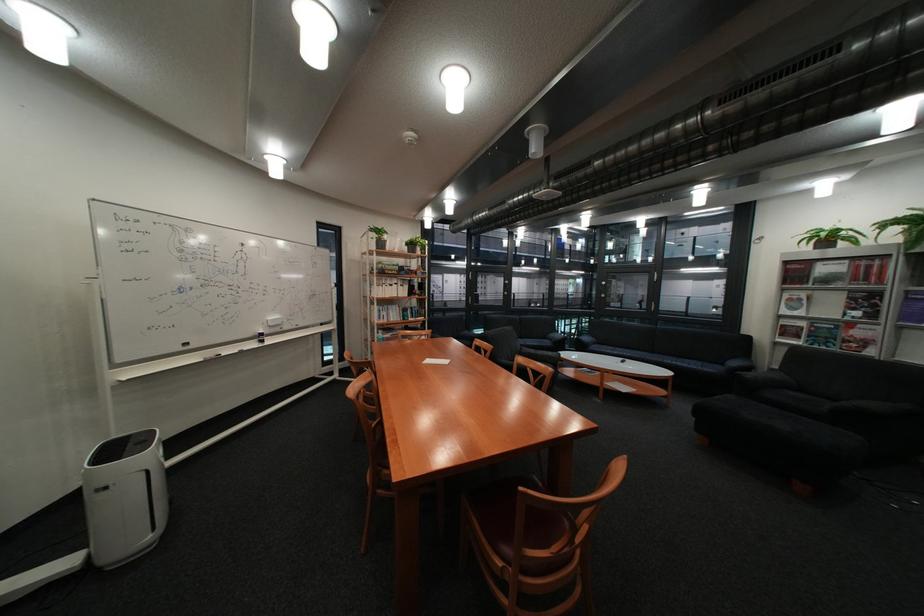
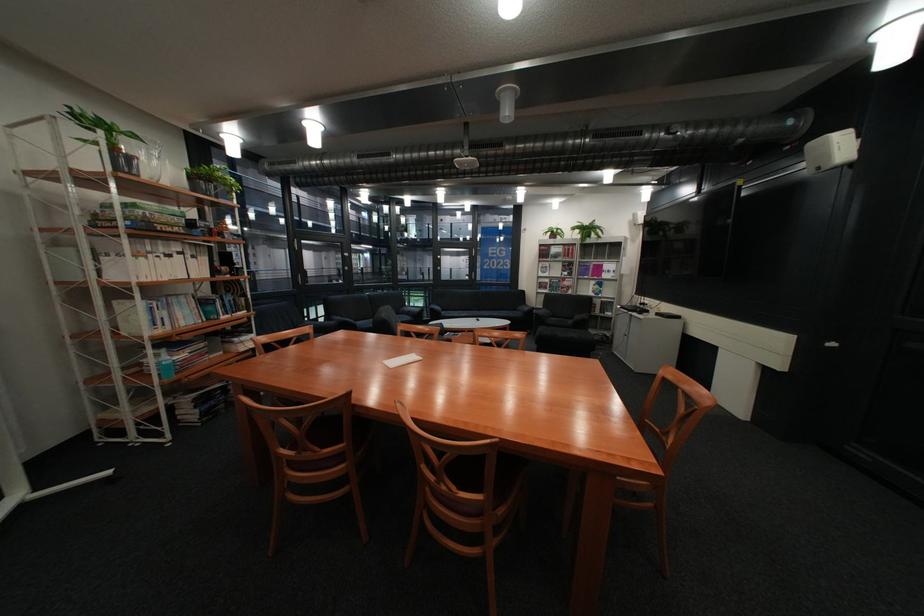
The point at (825, 238) is marked in the first image. Where is the corresponding point in the second image?

(562, 233)